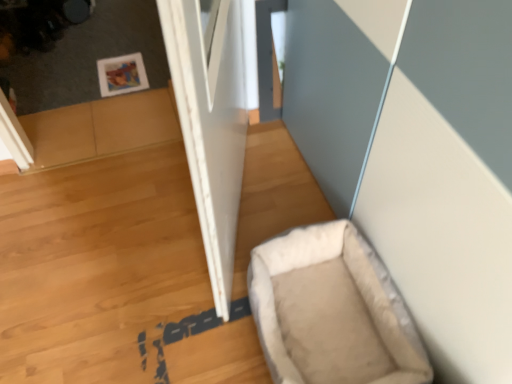
Identify the location of free spot in front of white matte door at center. click(x=163, y=321).